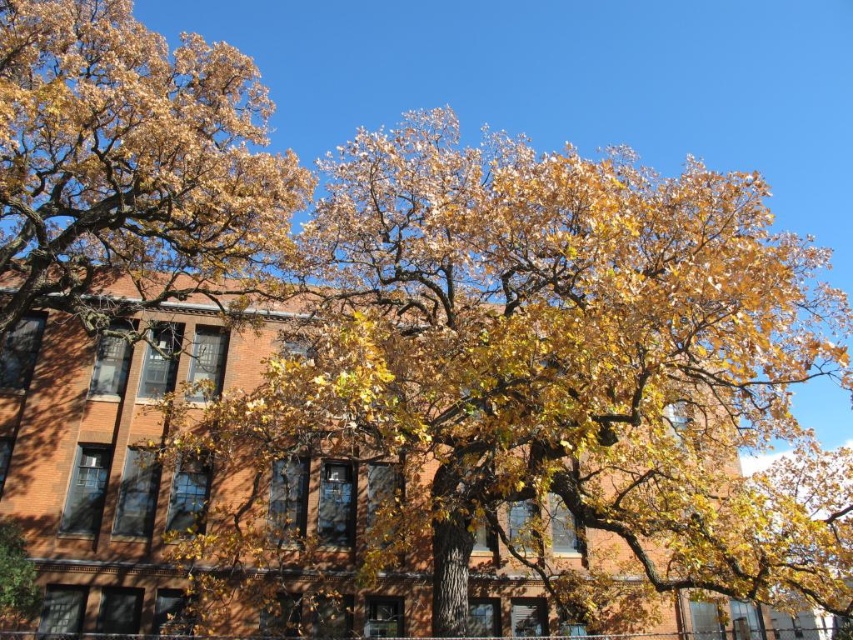
Which is in front, point (335, 417) or point (270, 173)?

Point (335, 417) is more forward.

From the picture: Between yellow leafy oak tree at left and yellow leafy tree at upper left, which one appears on the left side from the viewer's perspective?

Positioned to the left is yellow leafy tree at upper left.

Looking at this image, who is more forward, (323,408) or (125,189)?

Point (323,408) is more forward.

Where is `yellow leafy oak tree at left`? The width and height of the screenshot is (853, 640). yellow leafy oak tree at left is located at coordinates (534, 380).